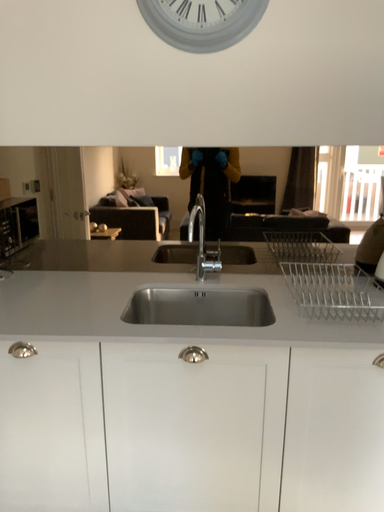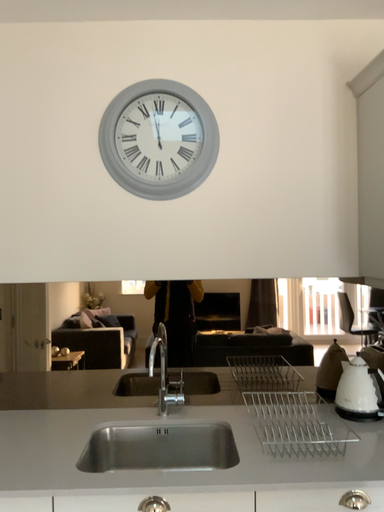
Question: How did the camera likely rotate when shooting the video?

Choices:
 (A) rotated upward
 (B) rotated downward

Answer: (A)